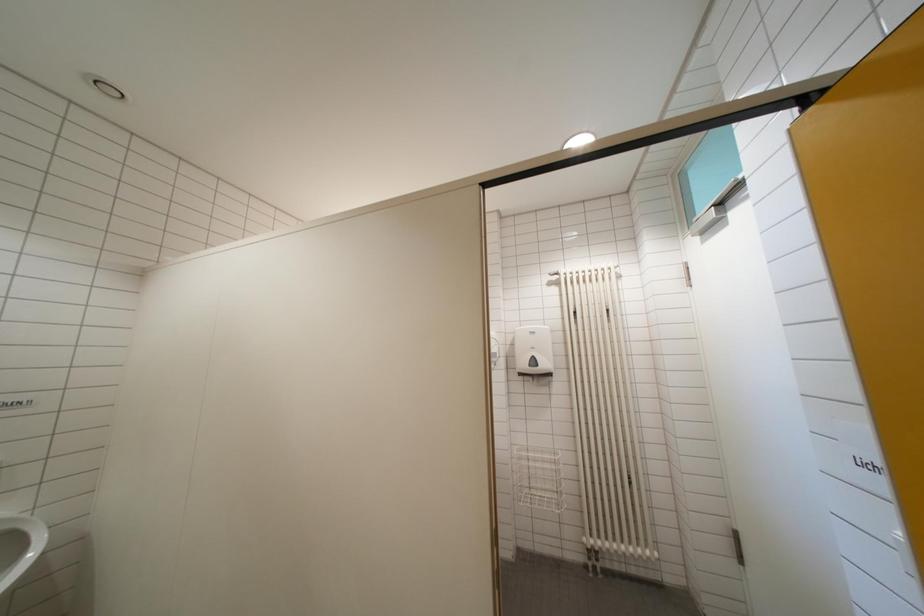
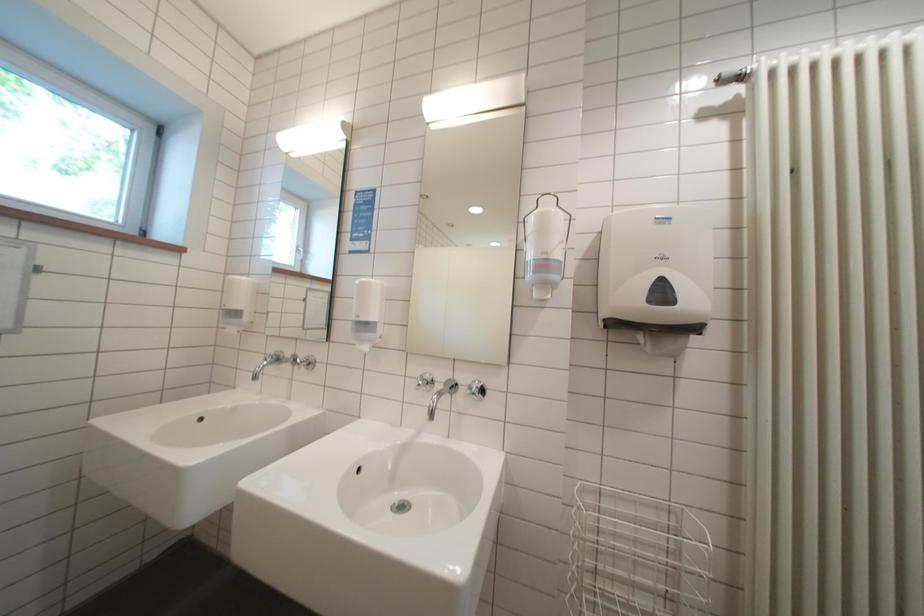
Question: The images are taken continuously from a first-person perspective. In which direction are you moving?

Choices:
 (A) Left
 (B) Right
 (C) Forward
 (D) Backward

Answer: (C)